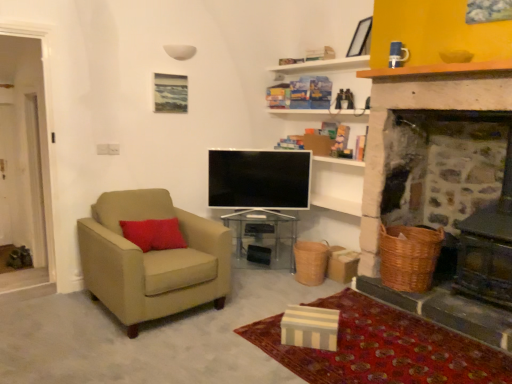
Question: Can you confirm if transparent acrylic table at center is thinner than woven brown basket at right, which is counted as the first basket, starting from the front?

Choices:
 (A) yes
 (B) no

Answer: (B)

Question: Would you say transparent acrylic table at center is outside woven brown basket at right, the 2th basket when ordered from back to front?

Choices:
 (A) yes
 (B) no

Answer: (A)

Question: Does transparent acrylic table at center have a lesser height compared to woven brown basket at right, the 2th basket when ordered from back to front?

Choices:
 (A) yes
 (B) no

Answer: (B)

Question: Does transparent acrylic table at center contain woven brown basket at right, which is the 2th basket in left-to-right order?

Choices:
 (A) no
 (B) yes

Answer: (A)

Question: Can you confirm if transparent acrylic table at center is taller than woven brown basket at right, which is counted as the first basket, starting from the front?

Choices:
 (A) no
 (B) yes

Answer: (B)

Question: Is transparent acrylic table at center to the left of woven brown basket at right, which appears as the first basket when viewed from the right, from the viewer's perspective?

Choices:
 (A) yes
 (B) no

Answer: (A)

Question: Would you say striped fabric box at lower center is outside beige fabric armchair at left?

Choices:
 (A) yes
 (B) no

Answer: (A)

Question: Can you confirm if striped fabric box at lower center is bigger than beige fabric armchair at left?

Choices:
 (A) no
 (B) yes

Answer: (A)

Question: Considering the relative sizes of striped fabric box at lower center and beige fabric armchair at left in the image provided, is striped fabric box at lower center thinner than beige fabric armchair at left?

Choices:
 (A) no
 (B) yes

Answer: (A)

Question: Can you confirm if striped fabric box at lower center is smaller than beige fabric armchair at left?

Choices:
 (A) no
 (B) yes

Answer: (B)

Question: Is striped fabric box at lower center wider than beige fabric armchair at left?

Choices:
 (A) no
 (B) yes

Answer: (B)

Question: Is striped fabric box at lower center at the right side of beige fabric armchair at left?

Choices:
 (A) no
 (B) yes

Answer: (B)

Question: Is beige fabric armchair at left further to camera compared to flat screen tv at center?

Choices:
 (A) yes
 (B) no

Answer: (B)